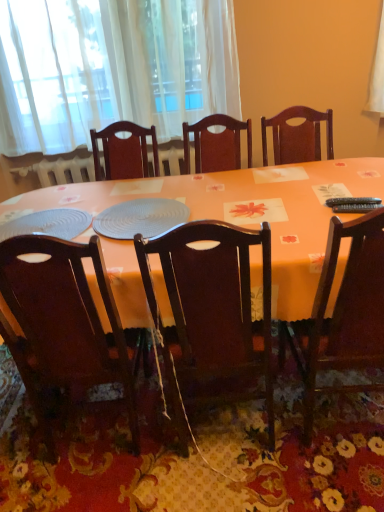
This screenshot has width=384, height=512. What are the coordinates of `vacant space to the right of matte blue placemat at center` in the screenshot? It's located at (235, 205).